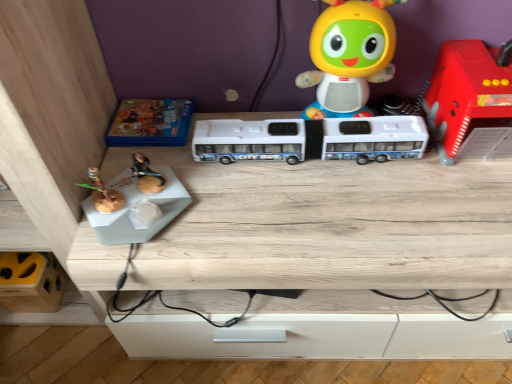
Where is `free space above white plastic bus at center, acting as the third toy starting from the right (from a real-world perspective)`? The image size is (512, 384). free space above white plastic bus at center, acting as the third toy starting from the right (from a real-world perspective) is located at coordinates (306, 124).